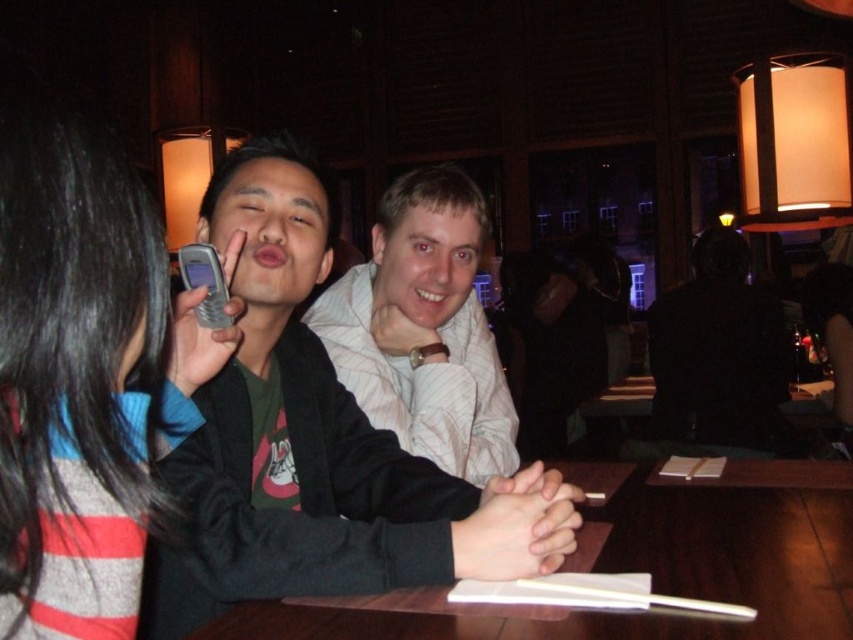
Does striped fabric hair at left have a lesser width compared to black matte jacket at center?

Correct, striped fabric hair at left's width is less than black matte jacket at center's.

Locate an element on the screen. This screenshot has height=640, width=853. striped fabric hair at left is located at coordinates (83, 376).

Which is behind, point (50, 529) or point (218, 324)?

Positioned behind is point (218, 324).

How far apart are striped fabric hair at left and silver metallic phone at center?

striped fabric hair at left is 11.13 inches from silver metallic phone at center.

In order to click on striped fabric hair at left in this screenshot , I will do `click(83, 376)`.

Between point (669, 632) and point (183, 248), which one is positioned behind?

Positioned behind is point (183, 248).

Does brown wooden table at center appear under silver metallic phone at center?

Yes, brown wooden table at center is below silver metallic phone at center.

The width and height of the screenshot is (853, 640). Describe the element at coordinates (641, 568) in the screenshot. I see `brown wooden table at center` at that location.

The height and width of the screenshot is (640, 853). Find the location of `brown wooden table at center`. brown wooden table at center is located at coordinates (641, 568).